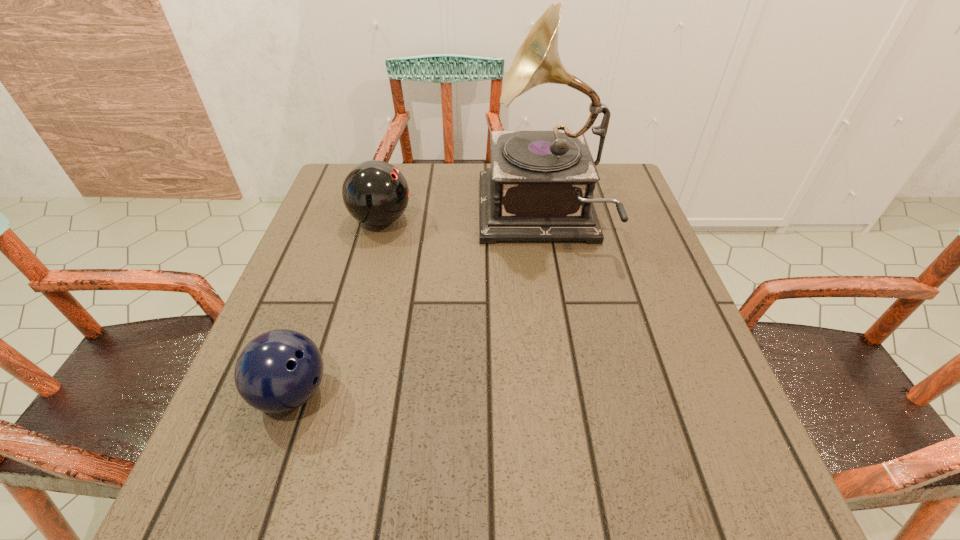
Identify the location of vacant space at the far left corner of the desktop. (348, 212).

Locate an element on the screen. The height and width of the screenshot is (540, 960). vacant space at the near right corner is located at coordinates (652, 490).

Identify the location of empty space that is in between the nearest object and the rightmost object. Image resolution: width=960 pixels, height=540 pixels. (417, 305).

Identify the location of vacant area that lies between the nearer bowling ball and the second tallest object. Image resolution: width=960 pixels, height=540 pixels. (337, 306).

Where is `empty space between the shorter bowling ball and the tallest object`? Image resolution: width=960 pixels, height=540 pixels. empty space between the shorter bowling ball and the tallest object is located at coordinates (417, 305).

Where is `empty location between the nearer bowling ball and the record player`? empty location between the nearer bowling ball and the record player is located at coordinates 417,305.

At what (x,y) coordinates should I click in order to perform the action: click on unoccupied area between the nearest object and the tallest object. Please return your answer as a coordinate pair (x, y). Looking at the image, I should click on (417, 305).

Where is `vacant area that lies between the tallest object and the second shortest object`? The image size is (960, 540). vacant area that lies between the tallest object and the second shortest object is located at coordinates (461, 218).

You are a GUI agent. You are given a task and a screenshot of the screen. Output one action in this format:
    pyautogui.click(x=<x>, y=<y>)
    Task: Click on the vacant area that lies between the nearer bowling ball and the tallest object
    
    Given the screenshot: What is the action you would take?
    pyautogui.click(x=417, y=305)

The width and height of the screenshot is (960, 540). I want to click on vacant region between the nearer bowling ball and the second tallest object, so click(337, 306).